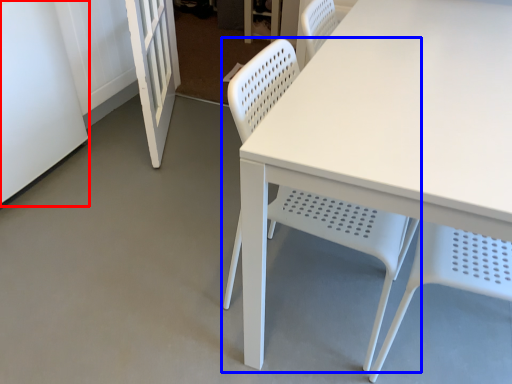
Question: Among these objects, which one is farthest to the camera, screen door (highlighted by a red box) or chair (highlighted by a blue box)?

Choices:
 (A) screen door
 (B) chair

Answer: (A)